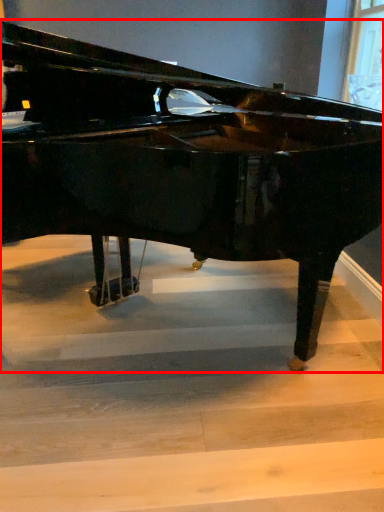
Question: Where is piano (annotated by the red box) located in relation to stairwell in the image?

Choices:
 (A) right
 (B) left

Answer: (B)